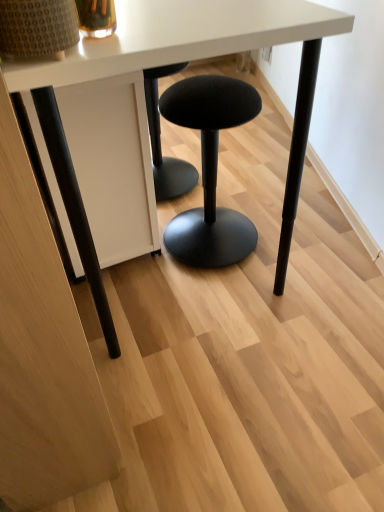
Question: Can you confirm if black fabric stool at center is thinner than black fabric stool at center?

Choices:
 (A) yes
 (B) no

Answer: (B)

Question: From a real-world perspective, does black fabric stool at center stand above black fabric stool at center?

Choices:
 (A) yes
 (B) no

Answer: (B)

Question: Is black fabric stool at center smaller than black fabric stool at center?

Choices:
 (A) yes
 (B) no

Answer: (B)

Question: Is there a large distance between black fabric stool at center and black fabric stool at center?

Choices:
 (A) no
 (B) yes

Answer: (A)

Question: Is black fabric stool at center positioned behind black fabric stool at center?

Choices:
 (A) no
 (B) yes

Answer: (B)

Question: From a real-world perspective, is black fabric stool at center above or below white matte table at center?

Choices:
 (A) below
 (B) above

Answer: (A)

Question: Choose the correct answer: Is black fabric stool at center inside white matte table at center or outside it?

Choices:
 (A) outside
 (B) inside

Answer: (B)

Question: In terms of height, does black fabric stool at center look taller or shorter compared to white matte table at center?

Choices:
 (A) tall
 (B) short

Answer: (B)

Question: From the image's perspective, relative to white matte table at center, is black fabric stool at center above or below?

Choices:
 (A) above
 (B) below

Answer: (B)

Question: From a real-world perspective, is white matte table at center above or below black fabric stool at center?

Choices:
 (A) below
 (B) above

Answer: (B)

Question: Looking at their shapes, would you say white matte table at center is wider or thinner than black fabric stool at center?

Choices:
 (A) wide
 (B) thin

Answer: (A)

Question: In terms of height, does white matte table at center look taller or shorter compared to black fabric stool at center?

Choices:
 (A) short
 (B) tall

Answer: (B)

Question: From the image's perspective, is white matte table at center above or below black fabric stool at center?

Choices:
 (A) above
 (B) below

Answer: (A)

Question: From a real-world perspective, relative to black fabric stool at center, is black fabric stool at center vertically above or below?

Choices:
 (A) above
 (B) below

Answer: (B)

Question: Does point (175, 238) appear closer or farther from the camera than point (168, 48)?

Choices:
 (A) closer
 (B) farther

Answer: (B)